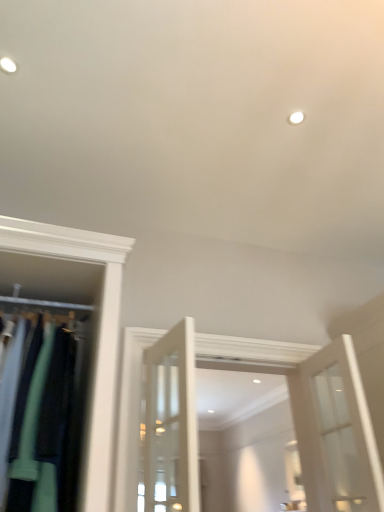
Question: From the image's perspective, is matte green fabric at left above or below white glass door at right?

Choices:
 (A) above
 (B) below

Answer: (A)

Question: Is matte green fabric at left bigger or smaller than white glass door at right?

Choices:
 (A) big
 (B) small

Answer: (A)

Question: Is matte green fabric at left to the left or to the right of white glass door at right in the image?

Choices:
 (A) left
 (B) right

Answer: (A)

Question: From their relative heights in the image, would you say white glass door at right is taller or shorter than matte green fabric at left?

Choices:
 (A) short
 (B) tall

Answer: (A)

Question: Looking at their shapes, would you say white glass door at right is wider or thinner than matte green fabric at left?

Choices:
 (A) thin
 (B) wide

Answer: (A)

Question: From a real-world perspective, is white glass door at right physically located above or below matte green fabric at left?

Choices:
 (A) below
 (B) above

Answer: (A)

Question: In the image, is white glass door at right positioned in front of or behind matte green fabric at left?

Choices:
 (A) front
 (B) behind

Answer: (B)